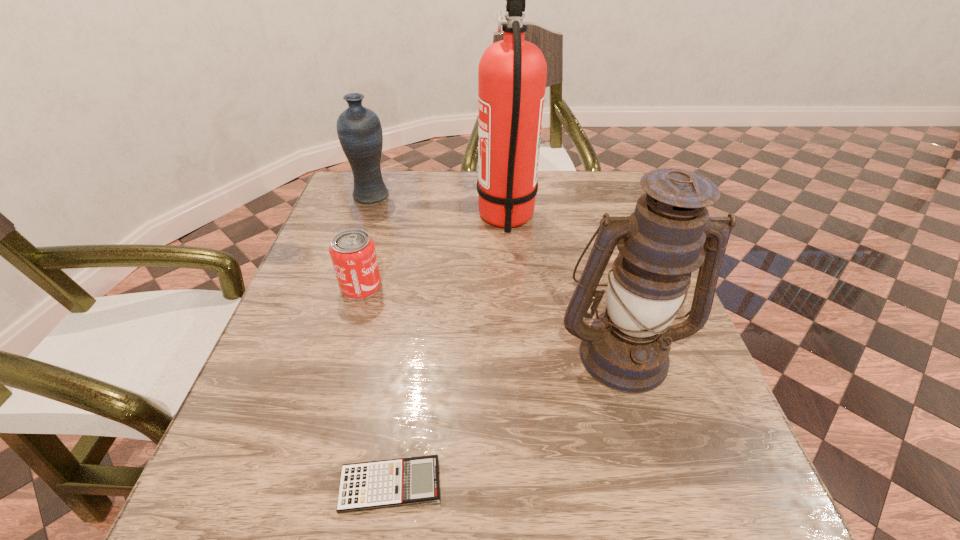
This screenshot has width=960, height=540. In order to click on object present at the right edge in this screenshot , I will do `click(626, 348)`.

Identify the location of object at the far left corner. This screenshot has height=540, width=960. (359, 130).

Locate an element on the screen. The image size is (960, 540). vacant point at the far edge is located at coordinates (465, 204).

At what (x,y) coordinates should I click in order to perform the action: click on vacant area at the left edge. Please return your answer as a coordinate pair (x, y). Looking at the image, I should click on (313, 250).

Image resolution: width=960 pixels, height=540 pixels. Identify the location of vacant space at the right edge of the desktop. (718, 429).

Locate an element on the screen. vacant area at the far left corner of the desktop is located at coordinates (382, 171).

Find the location of `free space at the far right corner`. free space at the far right corner is located at coordinates (608, 183).

Where is `blank area at the near right corner`? This screenshot has height=540, width=960. blank area at the near right corner is located at coordinates (x=709, y=531).

Find the location of a particular element. unoccupied position between the vase and the second tallest object is located at coordinates (496, 274).

At what (x,y) coordinates should I click in order to perform the action: click on empty space between the third shortest object and the oil lamp. Please return your answer as a coordinate pair (x, y). Looking at the image, I should click on (496, 274).